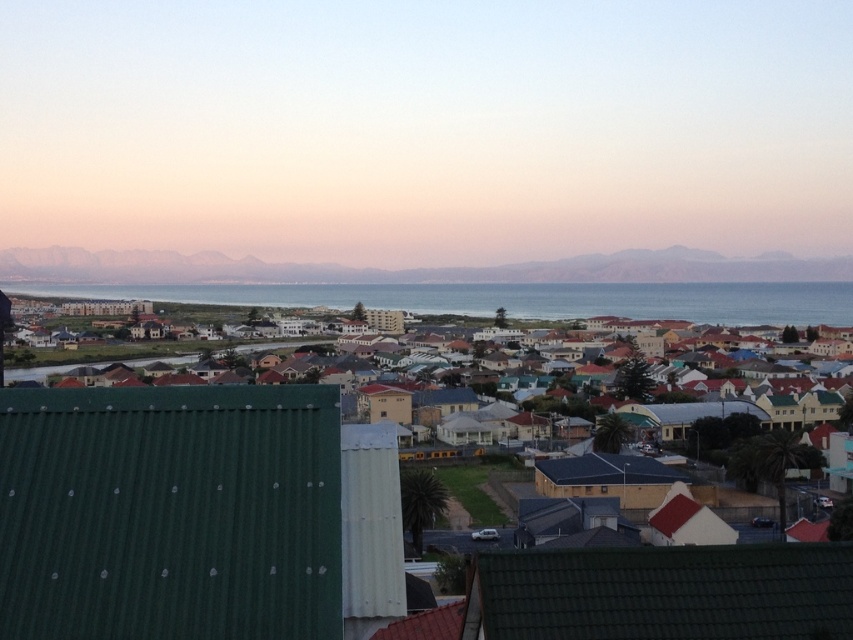
You are standing in the coastal town and want to take a photo of the sea. You notice two points marked in the image. Which point is closer to you, point (x=210, y=538) or point (x=758, y=307)?

Point (x=210, y=538) is closer to the viewer than point (x=758, y=307).

Based on the scene description, where is the green corrugated metal town at center located in the image?

The green corrugated metal town at center is located at point (190, 513) in the image.

You are standing at the point marked by the coordinates point (190, 513) in the coastal town. Looking towards the sea, which direction should you walk to reach the nearest palm tree?

The green corrugated metal town at center is represented by point (190, 513). Since the nearest palm trees are scattered in the middle ground area towards the sea, you should walk towards the sea direction from the point (190, 513) to reach the nearest palm tree.